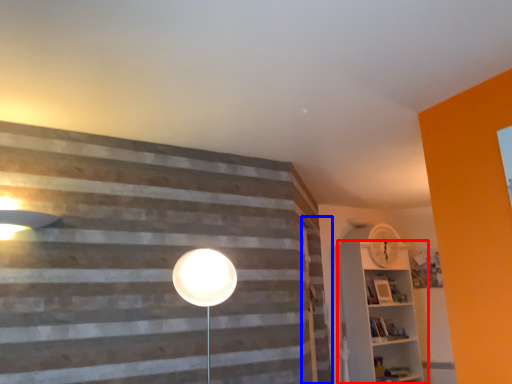
Question: Which object appears closest to the camera in this image, shelf (highlighted by a red box) or barn door (highlighted by a blue box)?

Choices:
 (A) shelf
 (B) barn door

Answer: (B)